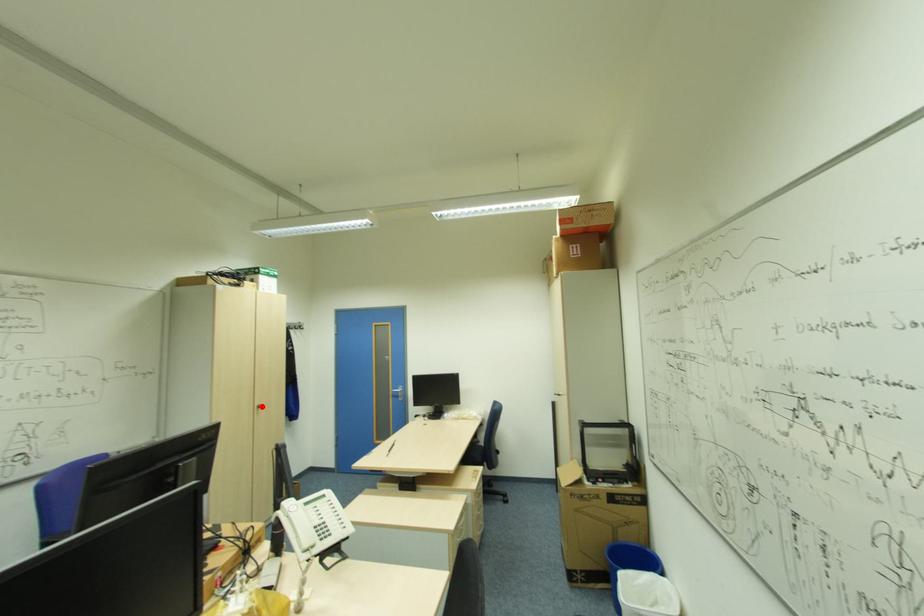
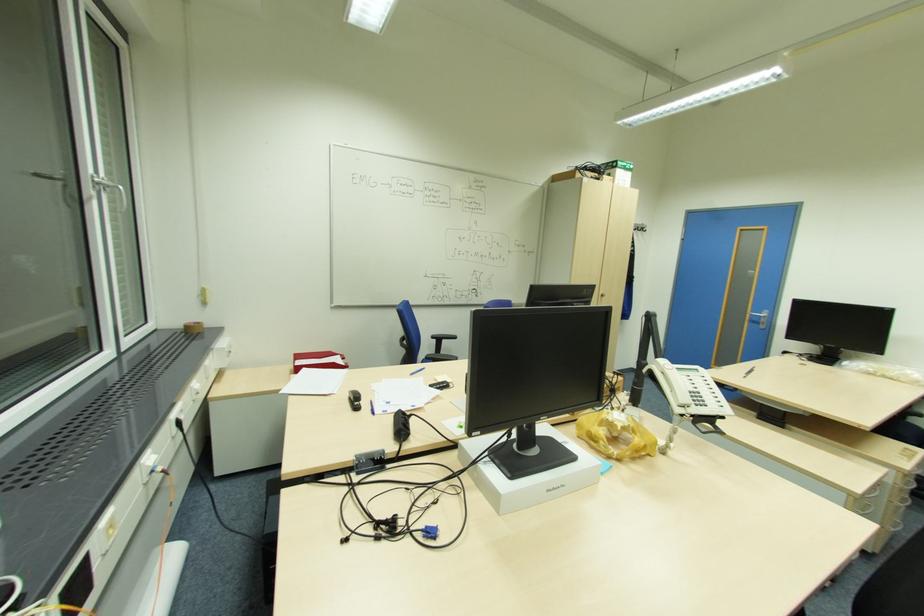
Where in the second image is the point corresponding to the highlighted location from the first image?

(604, 294)